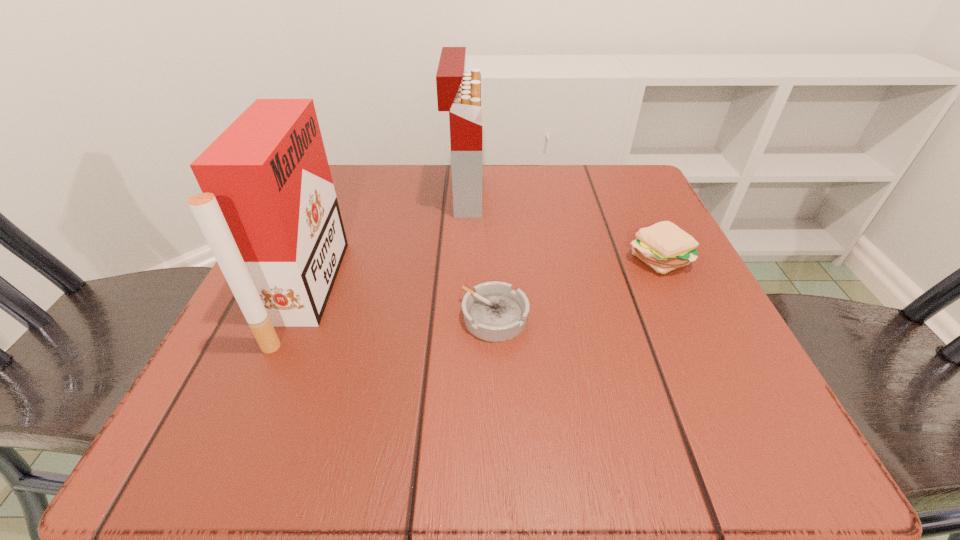
The image size is (960, 540). In order to click on the right cigarette case in this screenshot , I will do `click(460, 93)`.

The height and width of the screenshot is (540, 960). Find the location of `the farthest object`. the farthest object is located at coordinates (460, 93).

In order to click on the nearer cigarette case in this screenshot , I will do `click(268, 210)`.

Locate an element on the screen. the left cigarette case is located at coordinates (268, 210).

Locate an element on the screen. The height and width of the screenshot is (540, 960). the third tallest object is located at coordinates (663, 246).

I want to click on patty, so click(663, 246).

At what (x,y) coordinates should I click in order to perform the action: click on the shortest object. Please return your answer as a coordinate pair (x, y). The height and width of the screenshot is (540, 960). Looking at the image, I should click on (493, 311).

Identify the location of vacant space located with the lid open on the farthest object. The width and height of the screenshot is (960, 540). (576, 195).

Where is `vacant point located on the front-facing side of the nearer cigarette case`? This screenshot has height=540, width=960. vacant point located on the front-facing side of the nearer cigarette case is located at coordinates (558, 292).

What are the coordinates of `free point located 0.160m on the left of the patty` in the screenshot? It's located at pos(537,257).